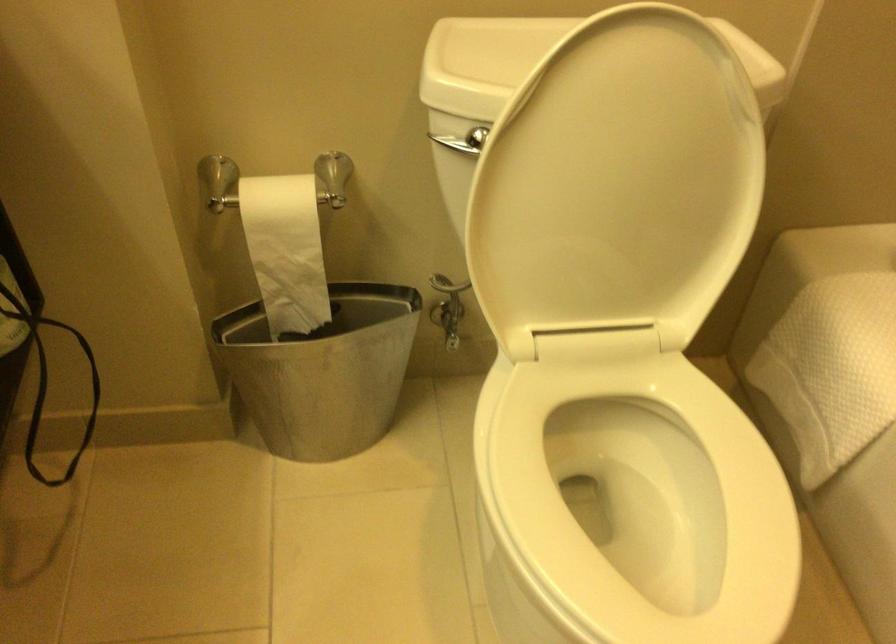
Where is `water valve handle`? water valve handle is located at coordinates (449, 325).